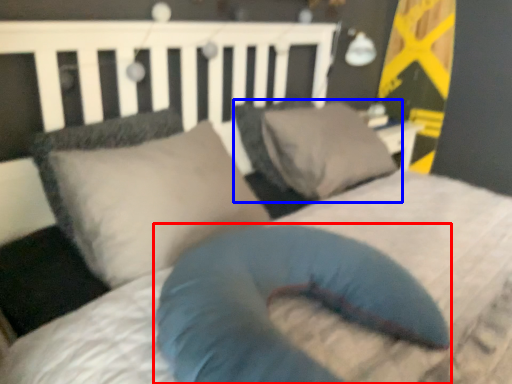
Question: Which object appears farthest to the camera in this image, pillow (highlighted by a red box) or pillow (highlighted by a blue box)?

Choices:
 (A) pillow
 (B) pillow

Answer: (B)